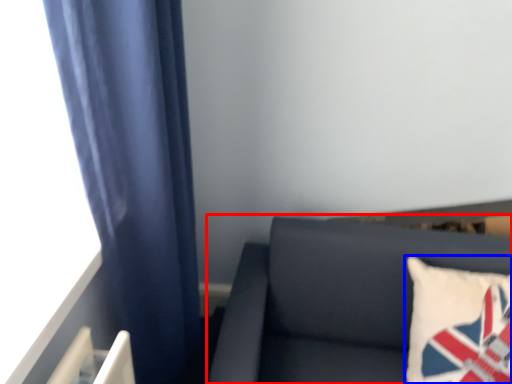
Question: Among these objects, which one is nearest to the camera, furniture (highlighted by a red box) or pillow (highlighted by a blue box)?

Choices:
 (A) furniture
 (B) pillow

Answer: (A)